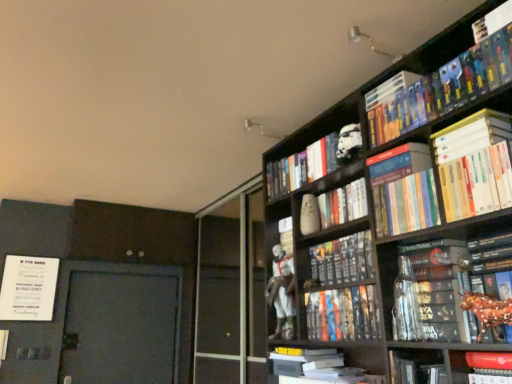
Question: From a real-world perspective, relative to hardcover book at upper right, which appears as the 12th book when ordered from the bottom, is hardcover books at upper right, which is the 11th book in bottom-to-top order, vertically above or below?

Choices:
 (A) below
 (B) above

Answer: (A)

Question: In terms of width, does hardcover books at upper right, which is the 11th book in bottom-to-top order, look wider or thinner when compared to hardcover book at upper right, which appears as the 12th book when ordered from the bottom?

Choices:
 (A) wide
 (B) thin

Answer: (B)

Question: Considering the real-world distances, which object is closest to the white matte book at lower center, acting as the 12th book starting from the top?

Choices:
 (A) hardcover book at upper right, which appears as the 1th book when viewed from the top
 (B) white matte vase at upper center, which appears as the 1th toy when ordered from the bottom
 (C) white glossy statue at center
 (D) hardcover book at center, positioned as the 2th book in bottom-to-top order
 (E) white matte helmet at upper center, positioned as the ninth book in bottom-to-top order

Answer: (D)

Question: Considering the real-world distances, which object is farthest from the white matte book at lower center, acting as the 12th book starting from the top?

Choices:
 (A) white matte book at upper right, which is the third book from top to bottom
 (B) hardcover books at upper right, arranged as the 5th book when viewed from the top
 (C) hardcover book at center, positioned as the seventh book in bottom-to-top order
 (D) white matte stormtrooper helmet at upper center, which is the first toy in top-to-bottom order
 (E) white matte helmet at upper center, positioned as the ninth book in bottom-to-top order

Answer: (A)